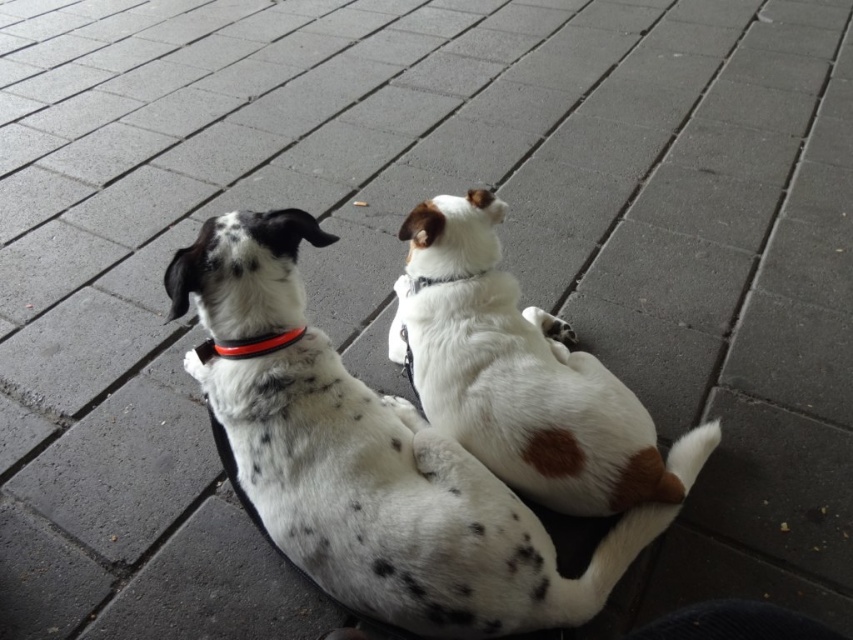
You are a dog owner looking at two neckbands in the image. The black rubber neckband at upper left and the white fabric neckband at upper center. Which neckband is positioned more to the left?

The black rubber neckband at upper left is positioned more to the left than the white fabric neckband at upper center.

You are a dog owner who wants to choose a collar for your new puppy. You see the black rubber neckband at upper left and the white fabric neckband at upper center in the image. Which collar is smaller in size?

The black rubber neckband at upper left is smaller than the white fabric neckband at upper center, so the black rubber neckband at upper left is the smaller one.